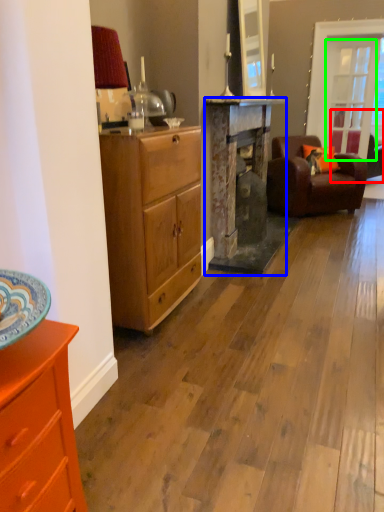
Question: Which is farther away from studio couch (highlighted by a red box)? fireplace (highlighted by a blue box) or glass door (highlighted by a green box)?

Choices:
 (A) fireplace
 (B) glass door

Answer: (A)